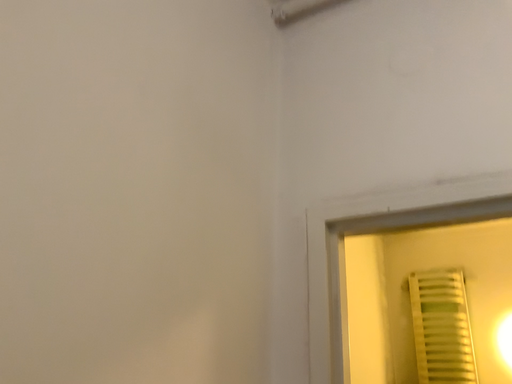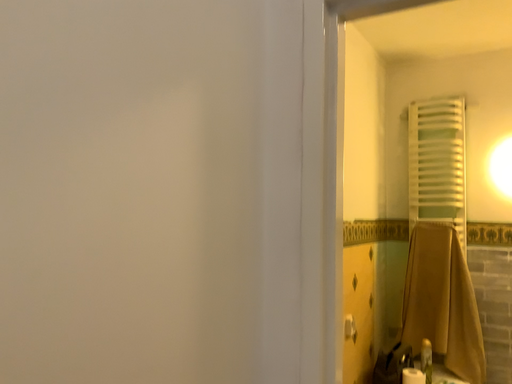
Question: How did the camera likely rotate when shooting the video?

Choices:
 (A) rotated downward
 (B) rotated upward

Answer: (A)